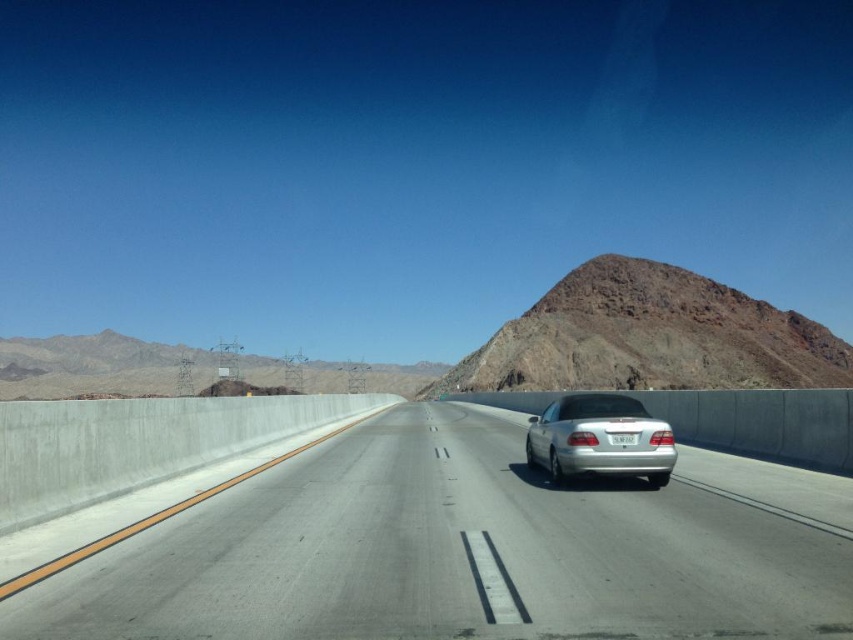
Question: Does silver metallic car at center have a larger size compared to silver metallic sedan at center?

Choices:
 (A) no
 (B) yes

Answer: (A)

Question: Can you confirm if rugged brown rock at upper right is positioned to the left of rugged rock mountain at upper center?

Choices:
 (A) yes
 (B) no

Answer: (B)

Question: Among these points, which one is farthest from the camera?

Choices:
 (A) (36, 392)
 (B) (624, 486)

Answer: (A)

Question: Is rugged rock mountain at upper center thinner than silver metallic sedan at center?

Choices:
 (A) no
 (B) yes

Answer: (A)

Question: Among these points, which one is nearest to the camera?

Choices:
 (A) (605, 355)
 (B) (12, 348)
 (C) (296, 481)
 (D) (543, 436)

Answer: (C)

Question: Which point is closer to the camera taking this photo?

Choices:
 (A) (669, 308)
 (B) (418, 515)

Answer: (B)